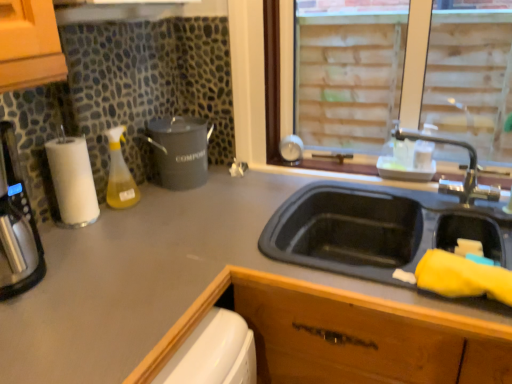
At what (x,y) coordinates should I click in order to perform the action: click on vacant area situated below brass metallic faucet at upper right (from a real-world perspective). Please return your answer as a coordinate pair (x, y). The width and height of the screenshot is (512, 384). Looking at the image, I should click on (438, 196).